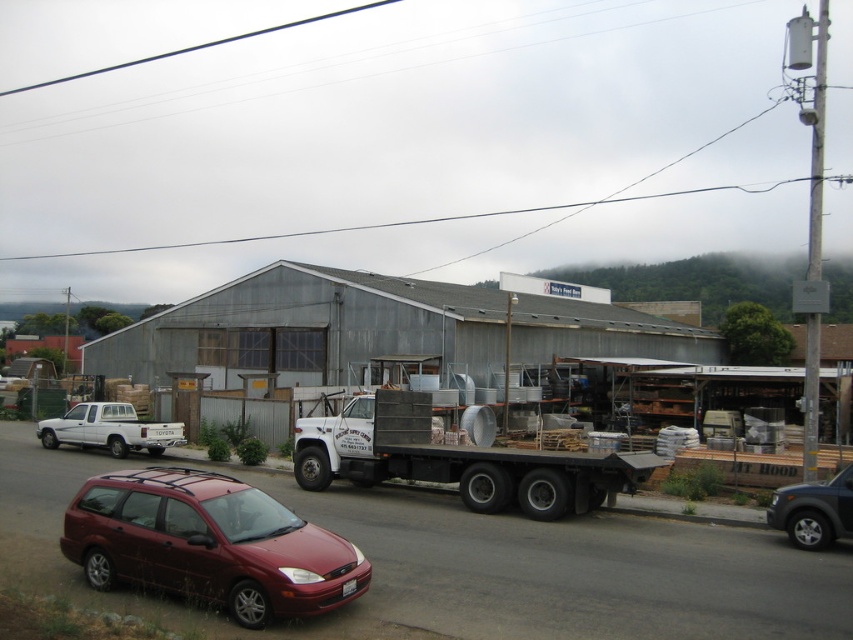
The height and width of the screenshot is (640, 853). Find the location of `metallic flatbed truck at center`. metallic flatbed truck at center is located at coordinates (456, 460).

Describe the element at coordinates (456, 460) in the screenshot. I see `metallic flatbed truck at center` at that location.

Where is `metallic flatbed truck at center`? The image size is (853, 640). metallic flatbed truck at center is located at coordinates (456, 460).

Can you confirm if metallic flatbed truck at center is thinner than white matte truck at left?

No.

Which is in front, point (317, 424) or point (70, 417)?

Point (317, 424)

Is point (318, 468) in front of point (155, 428)?

That is True.

Locate an element on the screen. Image resolution: width=853 pixels, height=640 pixels. metallic flatbed truck at center is located at coordinates (456, 460).

Is shiny red station wagon at lower left positioned before dark gray metallic suv at right?

Yes, shiny red station wagon at lower left is in front of dark gray metallic suv at right.

Who is higher up, shiny red station wagon at lower left or dark gray metallic suv at right?

Positioned higher is shiny red station wagon at lower left.

Does point (274, 589) lie in front of point (822, 490)?

Yes, point (274, 589) is closer to viewer.

The width and height of the screenshot is (853, 640). I want to click on shiny red station wagon at lower left, so click(x=209, y=545).